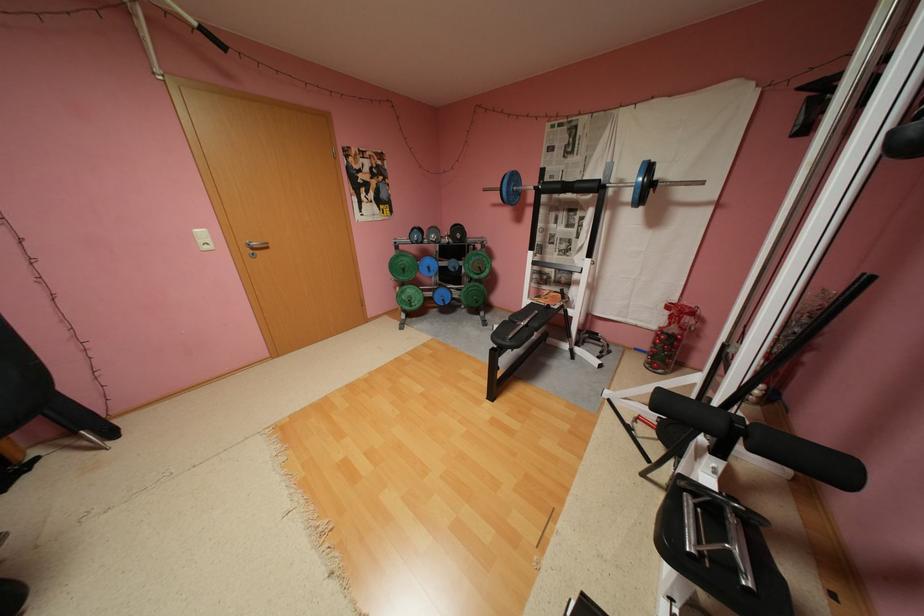
Identify the location of white light switch. The height and width of the screenshot is (616, 924). (202, 238).